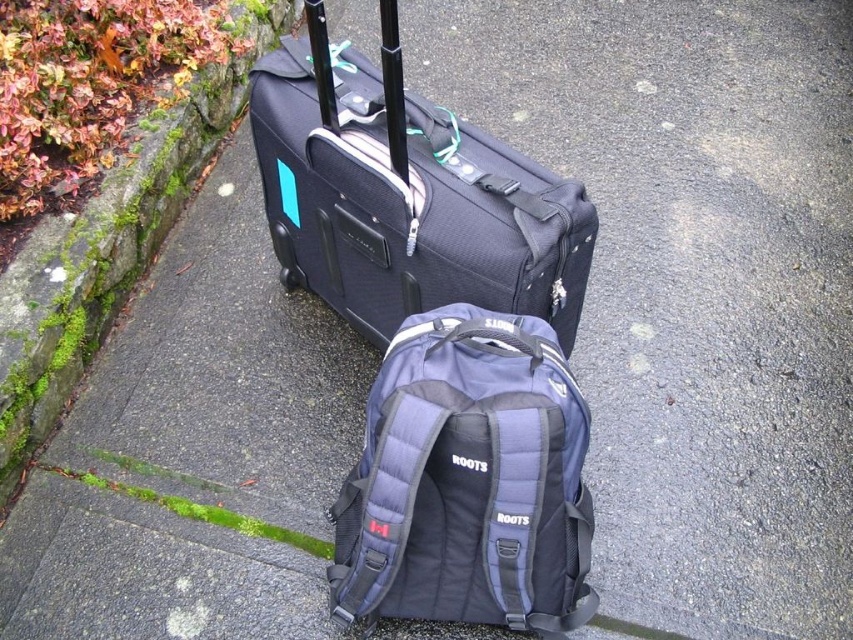
This screenshot has height=640, width=853. In order to click on matte black suitcase at center in this screenshot , I will do `click(405, 195)`.

Is matte black suitcase at center behind navy blue fabric backpack at center?

Yes, matte black suitcase at center is behind navy blue fabric backpack at center.

Which is behind, point (395, 236) or point (447, 429)?

The point (395, 236) is more distant.

Identify the location of matte black suitcase at center. This screenshot has width=853, height=640. (405, 195).

Does point (548, 563) lie in front of point (26, 340)?

Yes, point (548, 563) is closer to viewer.

Is point (386, 394) behind point (282, 3)?

No, (386, 394) is in front of (282, 3).

I want to click on navy blue fabric backpack at center, so click(x=468, y=481).

Is point (564, 298) positioned in front of point (45, 228)?

Yes.

Where is `matte black suitcase at center`? The width and height of the screenshot is (853, 640). matte black suitcase at center is located at coordinates (405, 195).